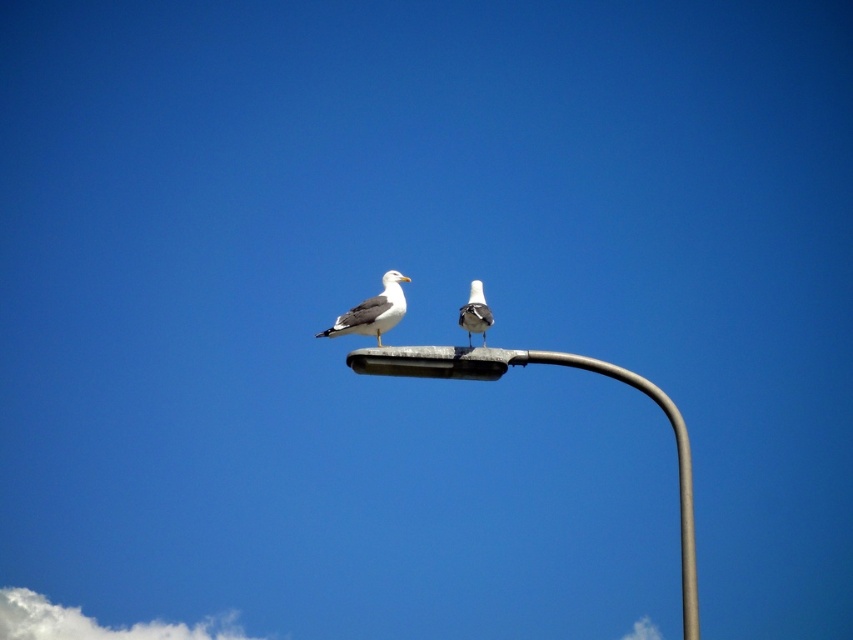
Consider the image. You are a birdwatcher trying to identify the birds on the street light. You have a camera with a zoom lens. Which object in the scene, the satin silver street light at upper center or the white matte bird at center, will appear bigger in your camera viewfinder?

The satin silver street light at upper center appears bigger in the camera viewfinder because it has a larger size compared to the white matte bird at center.

You are a photographer trying to capture a photo of the white matte seagull at center. To ensure the seagull is perfectly centered in your shot, you need to adjust your camera. What are the coordinates you should aim for?

The white matte seagull at center is located at coordinates point (373, 310), so you should aim your camera at those coordinates to center it.